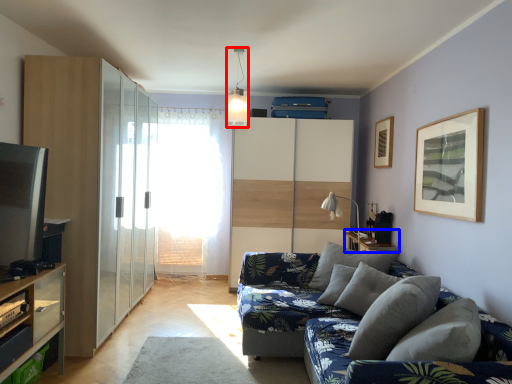
Question: Which object is closer to the camera taking this photo, light fixture (highlighted by a red box) or table (highlighted by a blue box)?

Choices:
 (A) light fixture
 (B) table

Answer: (A)